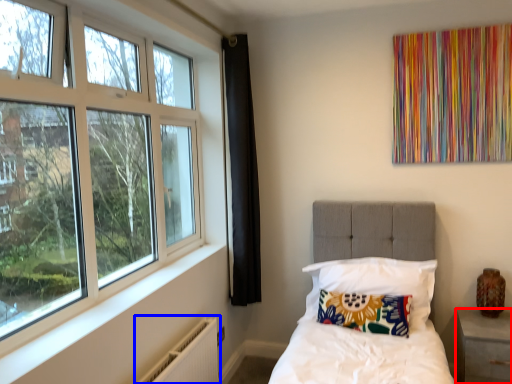
Question: Which of the following is the closest to the observer, nightstand (highlighted by a red box) or radiator (highlighted by a blue box)?

Choices:
 (A) nightstand
 (B) radiator

Answer: (B)